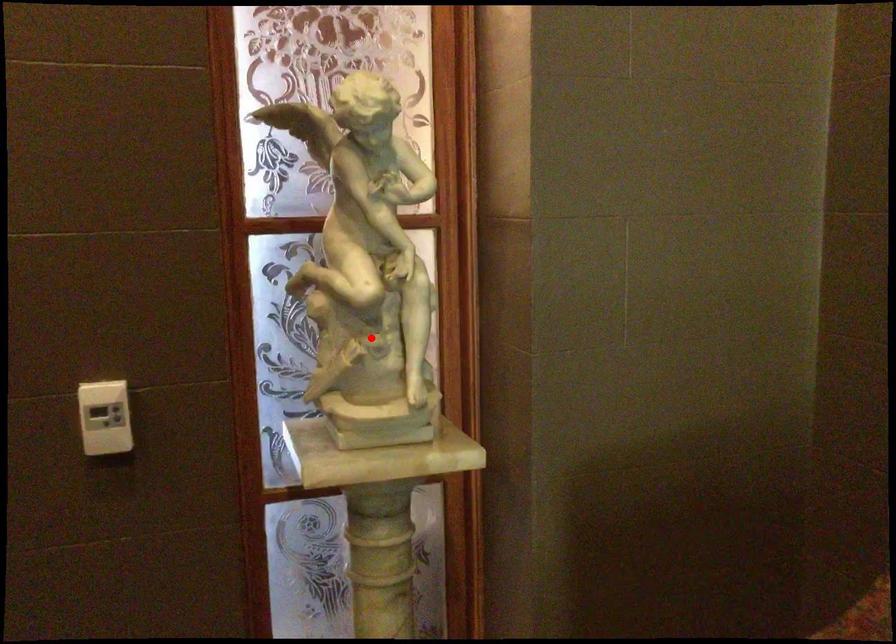
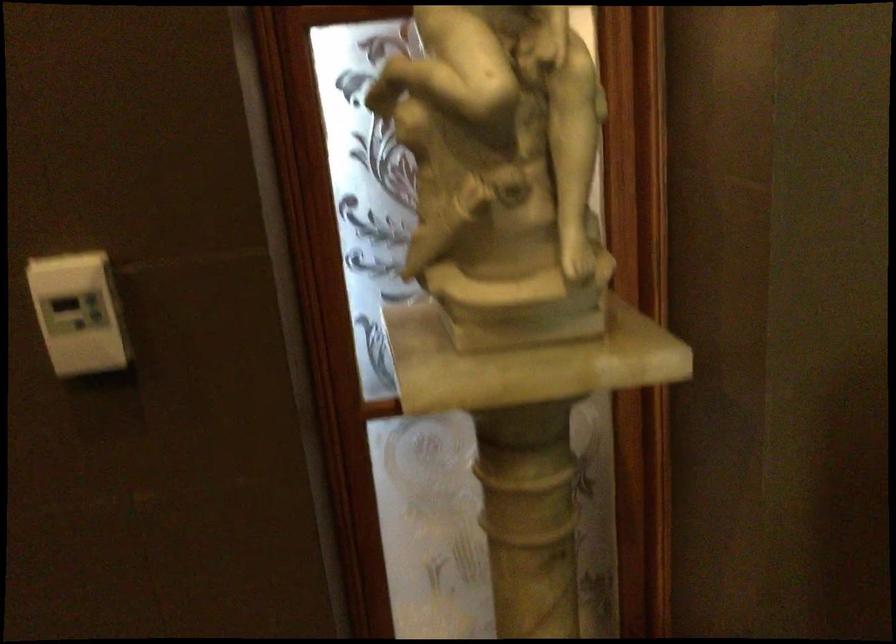
Question: I am providing you with two images of the same scene from different viewpoints. Image1 has a red point marked. In image2, the corresponding 3D location appears at what relative position? Reply with the corresponding letter.

Choices:
 (A) Closer
 (B) Farther

Answer: (A)